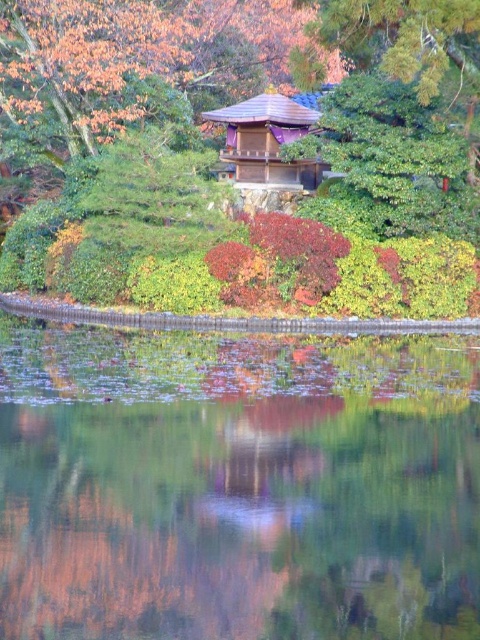
You are a visitor in the garden and want to take a photo of the transparent glass water at center and the green leafy bush at upper center. Which object should you focus on first if you want both to be in sharp focus?

You should focus on the green leafy bush at upper center first because it is farther away from the camera than the transparent glass water at center, ensuring both will be in focus with proper depth of field.

You are standing in the Japanese garden and want to take a photo of the wooden shingled hut at center without the green leafy bush at upper center blocking the view. Is the bush positioned in a way that it might obstruct the shot?

The green leafy bush at upper center is located above the wooden shingled hut at center, so it will obstruct the view of the hut unless you adjust your angle or position to avoid the bush.

You are standing at the entrance of the garden and want to take a photo of the point at coordinates point (x=145, y=477). The camera you are using has a maximum zoom range of 10 meters. Can you capture the point clearly without moving closer?

The distance of point (x=145, y=477) from camera is 13.49 meters, which is beyond the camera maximum zoom range of 10 meters. Therefore, you cannot capture the point clearly without moving closer.